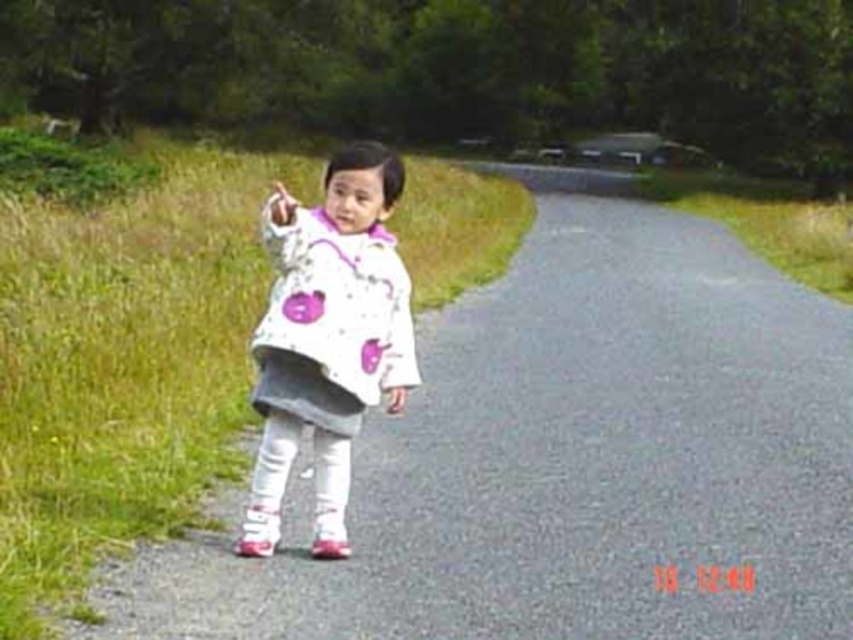
You are a fashion designer observing a child wearing a white matte jacket at center and holding a white matte hand at center. Which object has a smaller width?

The white matte jacket at center is thinner than the white matte hand at center, so the white matte jacket at center has a smaller width.

You are a photographer trying to capture the white matte jacket at center. Where exactly should you position your camera to ensure it is centered in your shot?

To center the white matte jacket at center in your shot, position your camera at point (329, 340).